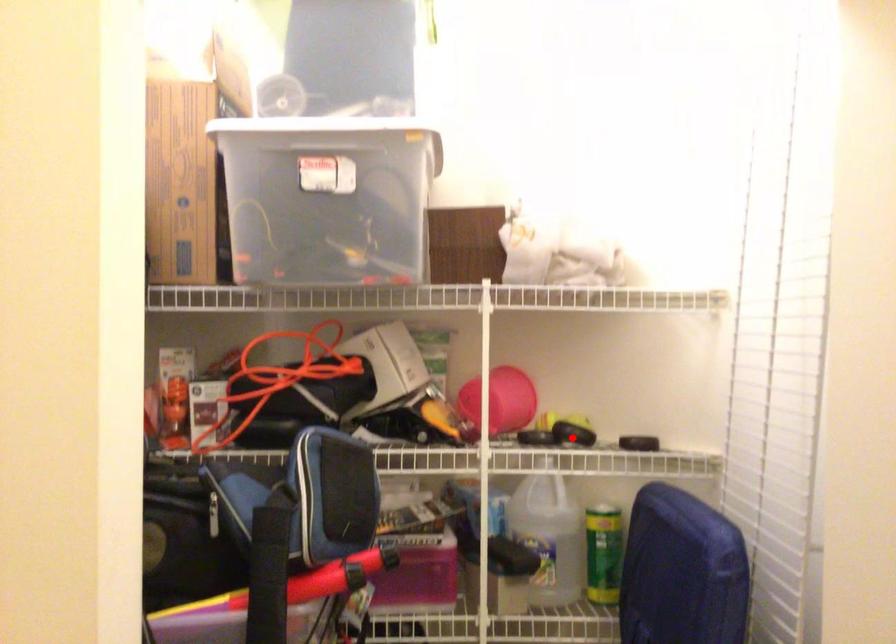
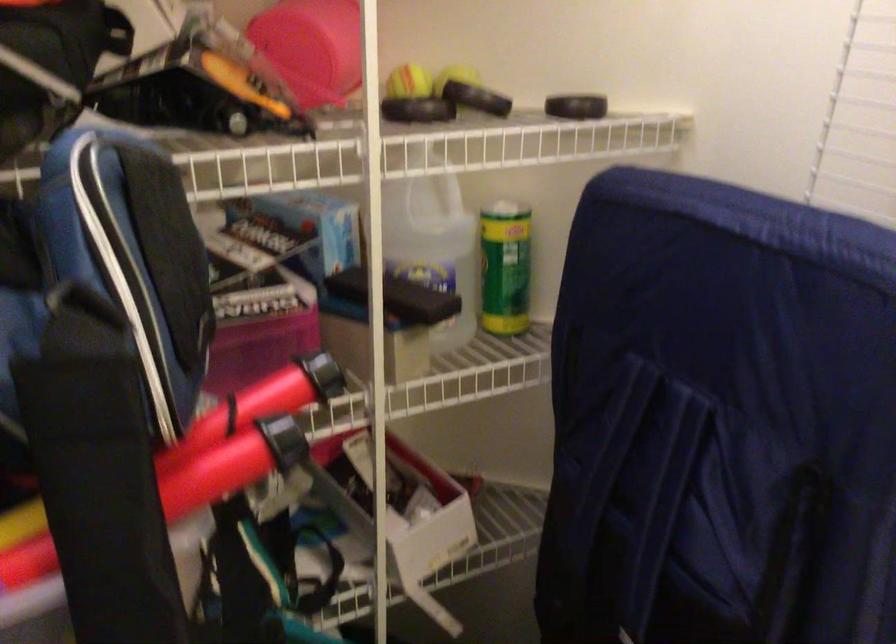
In the second image, find the point that corresponds to the highlighted location in the first image.

(487, 100)